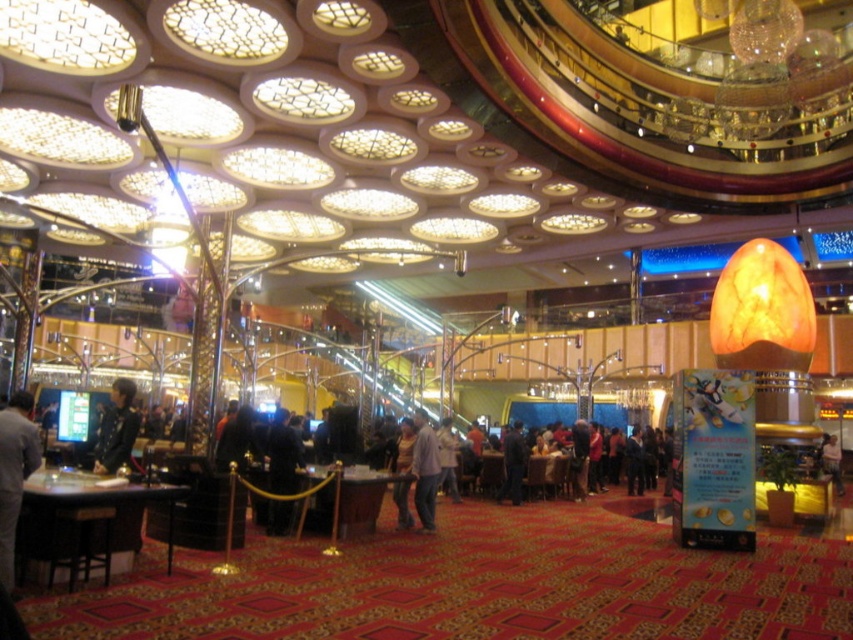
You are a fashion designer observing the casino interior and notice two garments at the center of the scene. Which garment has a larger size between the light brown fabric shirt at center and the dark gray fabric jacket at center?

The dark gray fabric jacket at center is larger than the light brown fabric shirt at center according to the description.

You are a customer at the casino and you see the gray fabric jacket at lower left and the light brown leather jacket at center. Which jacket is positioned higher in the image?

The gray fabric jacket at lower left is positioned higher than the light brown leather jacket at center.

You are standing at the entrance of the casino and want to reach the point marked at coordinates [431,429]. Given that the casino is 50 feet long from entrance to back, will you have to walk the entire length of the casino to reach that point?

The distance of point [431,429] from viewer is 41.80 feet, so you will not have to walk the entire 50 feet length to reach it since it is only 41.80 feet away.